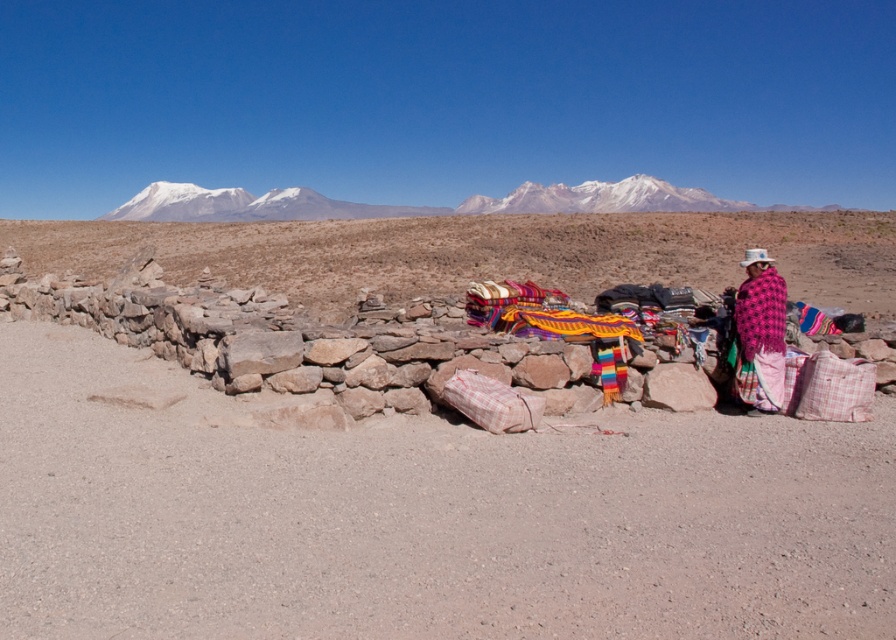
Who is lower down, white snow-covered mountain at upper center or pink woven shawl at right?

Positioned lower is pink woven shawl at right.

Is white snow-covered mountain at upper center in front of pink woven shawl at right?

No, white snow-covered mountain at upper center is behind pink woven shawl at right.

Locate an element on the screen. The width and height of the screenshot is (896, 640). white snow-covered mountain at upper center is located at coordinates (248, 205).

Is desert sand at center above white snow-covered mountain at center?

No.

The width and height of the screenshot is (896, 640). What do you see at coordinates (421, 516) in the screenshot?
I see `desert sand at center` at bounding box center [421, 516].

This screenshot has width=896, height=640. Describe the element at coordinates (421, 516) in the screenshot. I see `desert sand at center` at that location.

Locate an element on the screen. Image resolution: width=896 pixels, height=640 pixels. desert sand at center is located at coordinates (421, 516).

Can you confirm if white snow-covered mountain at upper center is thinner than white snow-covered mountain at center?

No, white snow-covered mountain at upper center is not thinner than white snow-covered mountain at center.

The image size is (896, 640). Describe the element at coordinates (248, 205) in the screenshot. I see `white snow-covered mountain at upper center` at that location.

The height and width of the screenshot is (640, 896). Describe the element at coordinates (248, 205) in the screenshot. I see `white snow-covered mountain at upper center` at that location.

Find the location of a particular element. The image size is (896, 640). white snow-covered mountain at upper center is located at coordinates (248, 205).